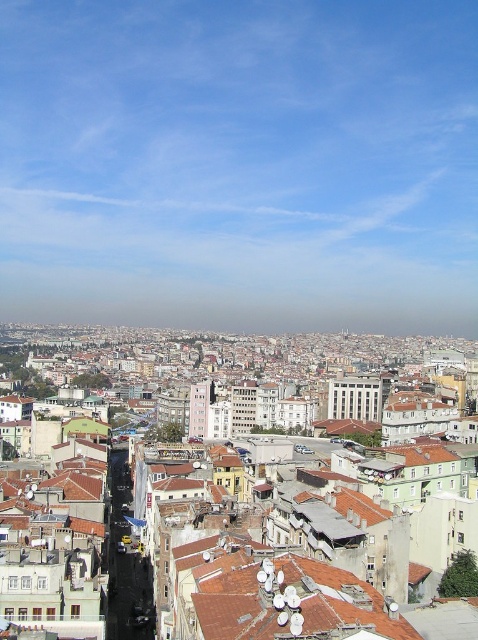
Question: Does brown tile roof at center have a lesser width compared to pink concrete building at center?

Choices:
 (A) yes
 (B) no

Answer: (B)

Question: Which of the following is the closest to the observer?

Choices:
 (A) white concrete building at center
 (B) pink concrete building at center
 (C) brown tile roof at center

Answer: (C)

Question: Is the position of brown tile roof at center less distant than that of pink concrete building at center?

Choices:
 (A) yes
 (B) no

Answer: (A)

Question: Which point is closer to the camera?

Choices:
 (A) (348, 625)
 (B) (202, 432)
 (C) (340, 388)

Answer: (A)

Question: Does brown tile roof at center have a larger size compared to pink concrete building at center?

Choices:
 (A) yes
 (B) no

Answer: (A)

Question: Which object appears closest to the camera in this image?

Choices:
 (A) pink concrete building at center
 (B) white concrete building at center

Answer: (B)